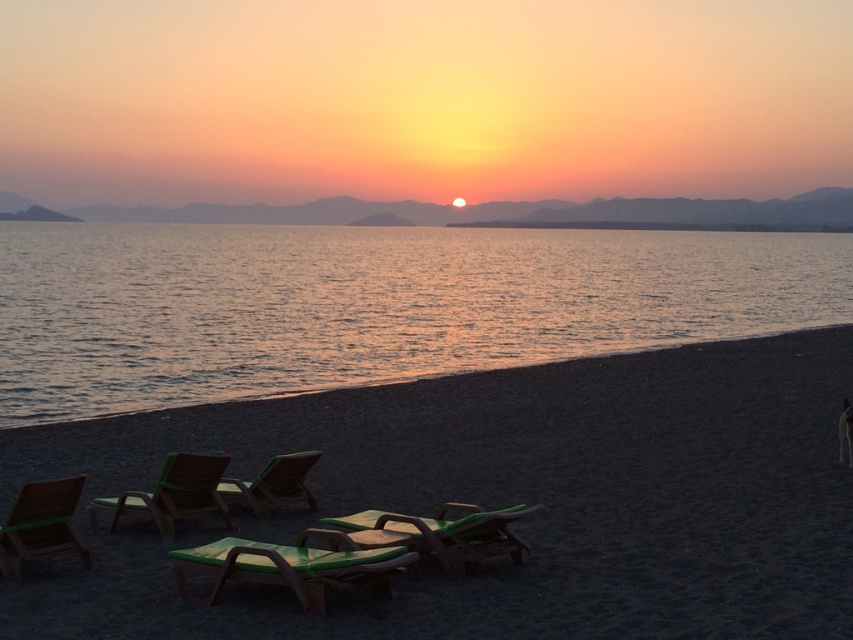
This screenshot has height=640, width=853. What do you see at coordinates (39, 525) in the screenshot? I see `green plastic beach chair at lower left` at bounding box center [39, 525].

Is the position of green plastic beach chair at lower left more distant than that of green fabric beach chair at lower left?

No, it is not.

This screenshot has width=853, height=640. I want to click on green plastic beach chair at lower left, so click(x=39, y=525).

Is dark sand at lower center closer to camera compared to green fabric beach chair at center?

Yes, dark sand at lower center is in front of green fabric beach chair at center.

Does point (723, 621) come farther from viewer compared to point (224, 493)?

That is False.

The height and width of the screenshot is (640, 853). In order to click on dark sand at lower center in this screenshot , I will do `click(506, 500)`.

From the picture: Can you confirm if glistening silver water at center is wider than green plastic beach chair at lower left?

Yes, glistening silver water at center is wider than green plastic beach chair at lower left.

Measure the distance between glistening silver water at center and green plastic beach chair at lower left.

glistening silver water at center and green plastic beach chair at lower left are 29.89 meters apart.

What do you see at coordinates (369, 305) in the screenshot?
I see `glistening silver water at center` at bounding box center [369, 305].

Image resolution: width=853 pixels, height=640 pixels. I want to click on glistening silver water at center, so click(x=369, y=305).